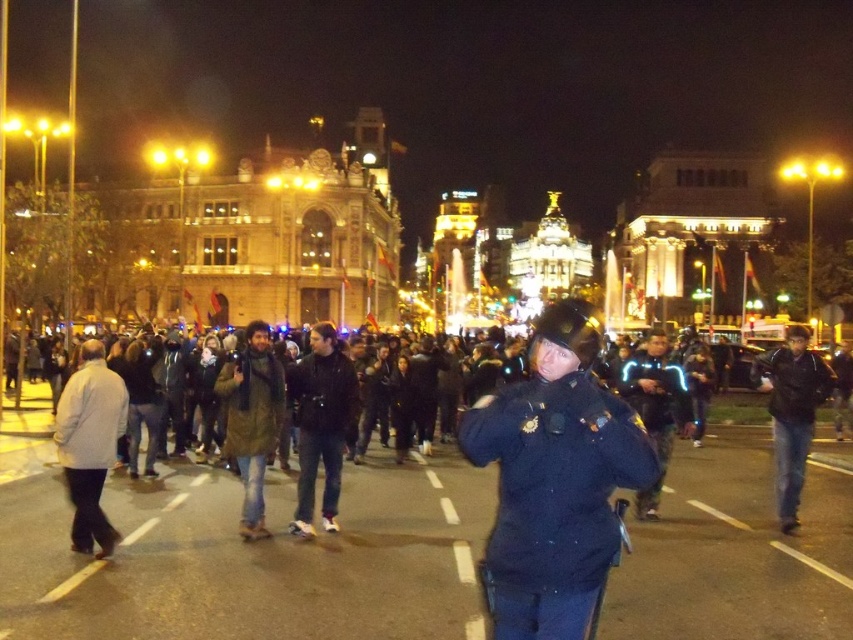
You are a photographer positioned at the edge of the crowd, aiming to capture the police officer in the foreground and the ornate building in the background. Given that the black leather jacket at center is positioned at coordinates point 0.662, 0.377, would adjusting your camera focus to this point ensure both the officer and the building are in focus?

The black leather jacket at center is located at point (321, 422). However, focusing on this point may not guarantee both the officer and the building are in focus, as the depth of field might not extend sufficiently from the foreground officer to the distant building.

You are a photographer trying to capture the scene from the ground level. You notice both the black uniformed officer at center and the black leather jacket at center. Which object is positioned higher in the frame?

The black uniformed officer at center is positioned higher in the frame than the black leather jacket at center.